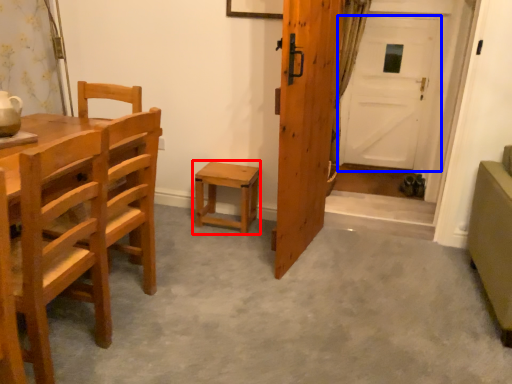
Question: Which point is further to the camera, stool (highlighted by a red box) or door (highlighted by a blue box)?

Choices:
 (A) stool
 (B) door

Answer: (B)